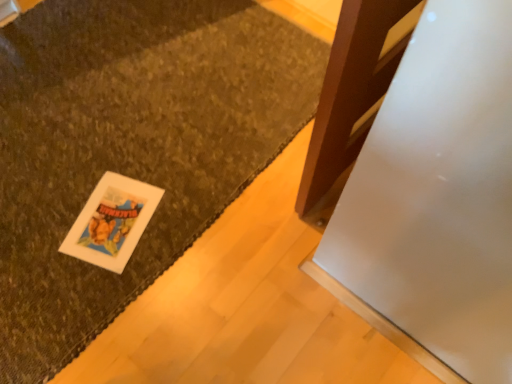
Describe the element at coordinates (130, 146) in the screenshot. This screenshot has height=384, width=512. I see `textured brown mat at lower left` at that location.

This screenshot has width=512, height=384. What are the coordinates of `textured brown mat at lower left` in the screenshot? It's located at (130, 146).

Measure the distance between point (128, 256) and camera.

Point (128, 256) is 4.24 feet away from camera.

What do you see at coordinates (112, 221) in the screenshot? I see `white matte card at lower left` at bounding box center [112, 221].

Locate an element on the screen. white matte card at lower left is located at coordinates (112, 221).

What are the coordinates of `textured brown mat at lower left` in the screenshot? It's located at (130, 146).

Is white matte card at lower left to the right of textured brown mat at lower left from the viewer's perspective?

Indeed, white matte card at lower left is positioned on the right side of textured brown mat at lower left.

Is white matte card at lower left positioned in front of textured brown mat at lower left?

No, white matte card at lower left is further to the viewer.

Does point (150, 215) come closer to viewer compared to point (35, 173)?

Yes, point (150, 215) is in front of point (35, 173).

From the image's perspective, is white matte card at lower left located above or below textured brown mat at lower left?

white matte card at lower left is below textured brown mat at lower left.

From a real-world perspective, which object rests below the other?

textured brown mat at lower left, from a real-world perspective.

Consider the image. Can you confirm if white matte card at lower left is thinner than textured brown mat at lower left?

Yes, white matte card at lower left is thinner than textured brown mat at lower left.

From their relative heights in the image, would you say white matte card at lower left is taller or shorter than textured brown mat at lower left?

Clearly, white matte card at lower left is shorter compared to textured brown mat at lower left.

Does white matte card at lower left have a smaller size compared to textured brown mat at lower left?

Yes, white matte card at lower left is smaller than textured brown mat at lower left.

Would you say white matte card at lower left contains textured brown mat at lower left?

No, textured brown mat at lower left is not inside white matte card at lower left.

Is white matte card at lower left not close to textured brown mat at lower left?

They are positioned close to each other.

Is white matte card at lower left looking in the opposite direction of textured brown mat at lower left?

That's right, white matte card at lower left is facing away from textured brown mat at lower left.

How many degrees apart are the facing directions of white matte card at lower left and textured brown mat at lower left?

112 degrees separate the facing orientations of white matte card at lower left and textured brown mat at lower left.

Find the location of `card that appears below the textured brown mat at lower left (from the image's perspective)`. card that appears below the textured brown mat at lower left (from the image's perspective) is located at coordinates (112, 221).

Is textured brown mat at lower left at the left side of white matte card at lower left?

Correct, you'll find textured brown mat at lower left to the left of white matte card at lower left.

Relative to white matte card at lower left, is textured brown mat at lower left in front or behind?

textured brown mat at lower left is in front of white matte card at lower left.

Which point is more distant from viewer, (155, 269) or (83, 221)?

The point (83, 221) is more distant.

From the image's perspective, is textured brown mat at lower left on white matte card at lower left?

Yes.

From a real-world perspective, which object stands above the other?

white matte card at lower left.

Does textured brown mat at lower left have a lesser width compared to white matte card at lower left?

Incorrect, the width of textured brown mat at lower left is not less than that of white matte card at lower left.

Which of these two, textured brown mat at lower left or white matte card at lower left, stands taller?

With more height is textured brown mat at lower left.

In the scene shown: Considering the relative sizes of textured brown mat at lower left and white matte card at lower left in the image provided, is textured brown mat at lower left bigger than white matte card at lower left?

Yes, textured brown mat at lower left is bigger than white matte card at lower left.

Is textured brown mat at lower left spatially inside white matte card at lower left, or outside of it?

textured brown mat at lower left lies outside white matte card at lower left.

From the picture: Is textured brown mat at lower left positioned far away from white matte card at lower left?

No.

Is textured brown mat at lower left oriented towards white matte card at lower left?

Yes.

What's the angular difference between textured brown mat at lower left and white matte card at lower left's facing directions?

The facing directions of textured brown mat at lower left and white matte card at lower left are 112 degrees apart.

Where is `card above the textured brown mat at lower left (from a real-world perspective)`? card above the textured brown mat at lower left (from a real-world perspective) is located at coordinates (112, 221).

The width and height of the screenshot is (512, 384). Find the location of `mat located in front of the white matte card at lower left`. mat located in front of the white matte card at lower left is located at coordinates (130, 146).

In order to click on card behind the textured brown mat at lower left in this screenshot , I will do `click(112, 221)`.